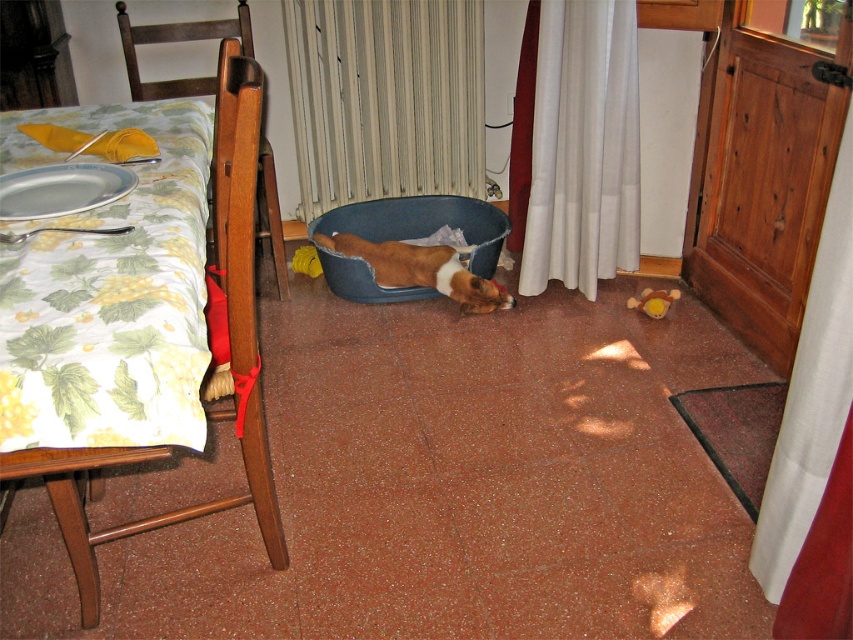
Does wooden chair at left appear over brown and white plush dog at center?

Correct, wooden chair at left is located above brown and white plush dog at center.

Which is more to the right, wooden chair at left or brown and white plush dog at center?

brown and white plush dog at center is more to the right.

Describe the element at coordinates (193, 84) in the screenshot. The height and width of the screenshot is (640, 853). I see `wooden chair at left` at that location.

Where is `wooden chair at left`? The image size is (853, 640). wooden chair at left is located at coordinates (193, 84).

Can you confirm if wooden chair at left is wider than white fabric curtain at lower right?

Yes, wooden chair at left is wider than white fabric curtain at lower right.

Can you confirm if wooden chair at left is shorter than white fabric curtain at lower right?

Indeed, wooden chair at left has a lesser height compared to white fabric curtain at lower right.

Image resolution: width=853 pixels, height=640 pixels. I want to click on wooden chair at left, so click(193, 84).

Image resolution: width=853 pixels, height=640 pixels. Find the location of `wooden chair at left`. wooden chair at left is located at coordinates (193, 84).

Between white fabric curtain at lower right and brown and white plush dog at center, which one is positioned lower?

white fabric curtain at lower right is below.

Which of these two, white fabric curtain at lower right or brown and white plush dog at center, stands taller?

Standing taller between the two is white fabric curtain at lower right.

Is point (834, 522) positioned after point (325, 241)?

No.

At what (x,y) coordinates should I click in order to perform the action: click on white fabric curtain at lower right. Please return your answer as a coordinate pair (x, y). Looking at the image, I should click on (822, 561).